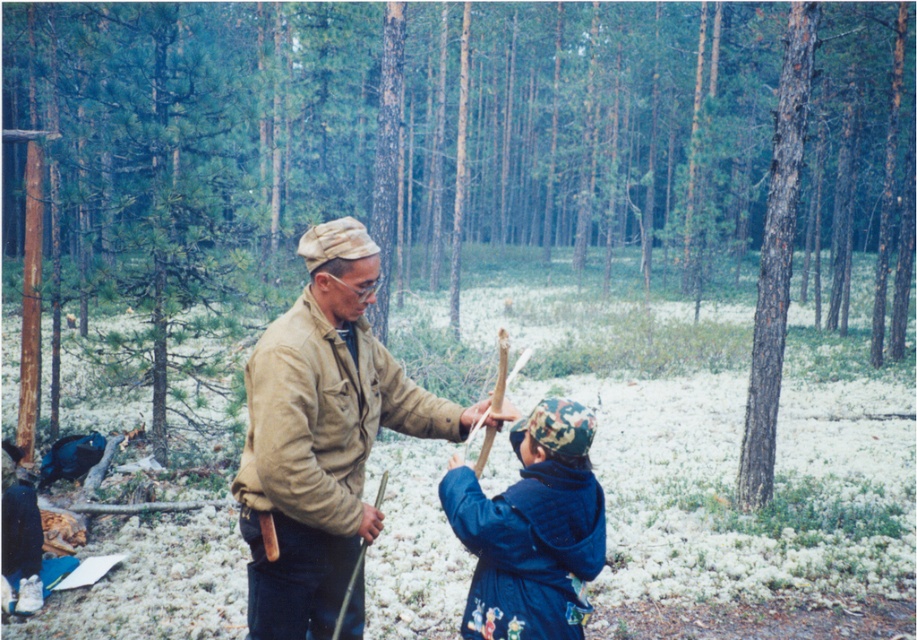
Describe the element at coordinates (321, 436) in the screenshot. I see `tan fabric jacket at center` at that location.

Who is taller, tan fabric jacket at center or camouflage fabric hat at center?

With more height is tan fabric jacket at center.

Does point (321, 296) lie behind point (505, 493)?

That is True.

This screenshot has height=640, width=917. Find the location of `tan fabric jacket at center`. tan fabric jacket at center is located at coordinates (321, 436).